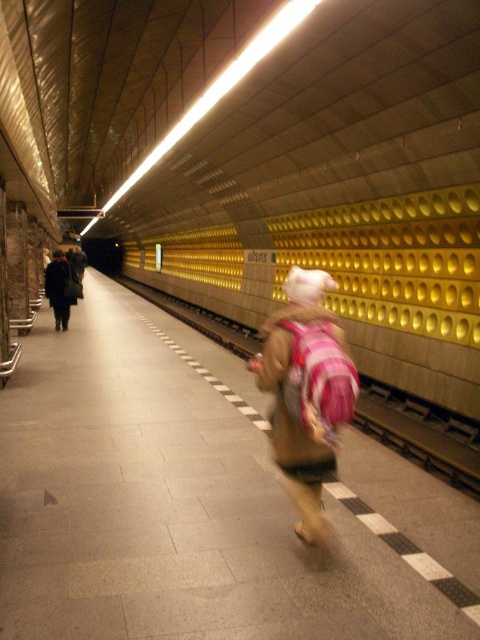
Question: Which point is closer to the camera taking this photo?

Choices:
 (A) (268, 321)
 (B) (66, 321)

Answer: (B)

Question: Is brown fuzzy coat at center to the right of dark wool coat at left from the viewer's perspective?

Choices:
 (A) no
 (B) yes

Answer: (B)

Question: In this image, where is brown fuzzy coat at center located relative to dark wool coat at left?

Choices:
 (A) left
 (B) right

Answer: (B)

Question: Among these points, which one is farthest from the camera?

Choices:
 (A) [x=61, y=276]
 (B) [x=315, y=280]

Answer: (A)

Question: Observing the image, what is the correct spatial positioning of brown fuzzy coat at center in reference to dark wool coat at left?

Choices:
 (A) above
 (B) below

Answer: (B)